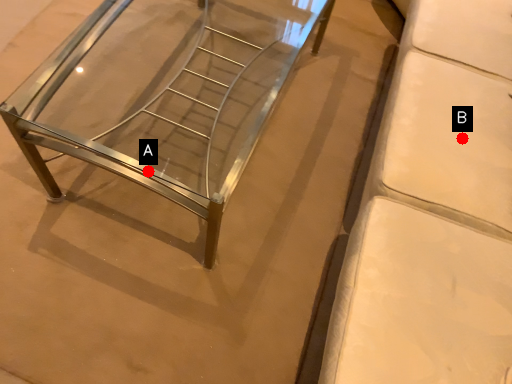
Question: Two points are circled on the image, labeled by A and B beside each circle. Which point appears farthest from the camera in this image?

Choices:
 (A) A is further
 (B) B is further

Answer: (B)